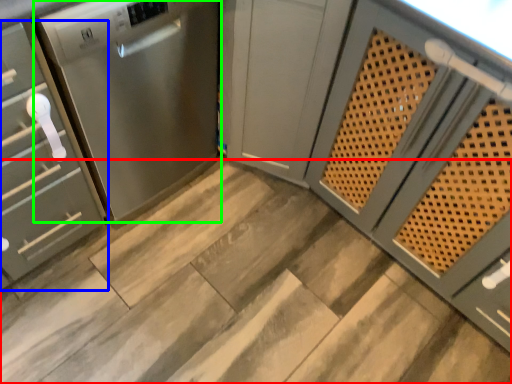
Question: Which object is the farthest from stair (highlighted by a red box)? Choose among these: cabinetry (highlighted by a blue box) or home appliance (highlighted by a green box).

Choices:
 (A) cabinetry
 (B) home appliance

Answer: (A)